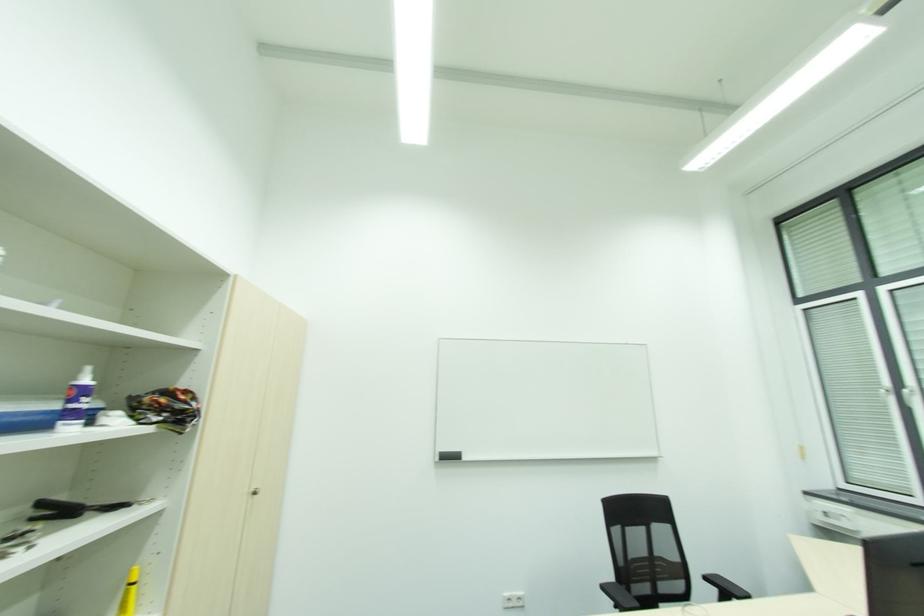
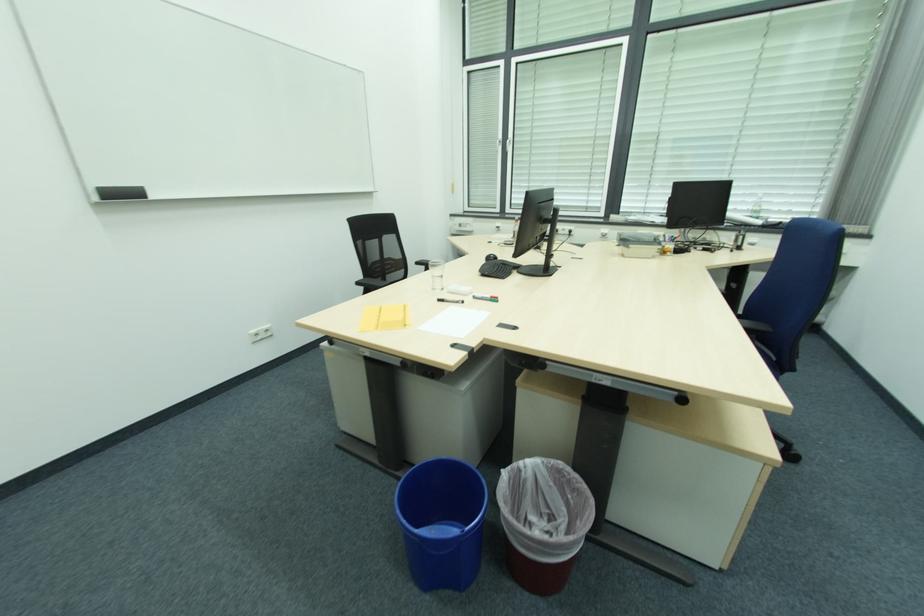
The images are taken continuously from a first-person perspective. In which direction is your viewpoint rotating?

The camera rotated toward right-down.